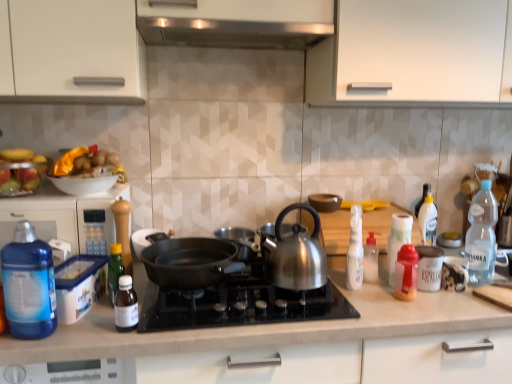
Question: Is blue plastic container at left behind translucent plastic bottle at lower left, marked as the sixth bottle in a right-to-left arrangement?

Choices:
 (A) yes
 (B) no

Answer: (A)

Question: From a real-world perspective, is blue plastic container at left physically above translucent plastic bottle at lower left, the third bottle viewed from the left?

Choices:
 (A) no
 (B) yes

Answer: (B)

Question: Is translucent plastic bottle at lower left, the third bottle viewed from the left, completely or partially inside blue plastic container at left?

Choices:
 (A) yes
 (B) no

Answer: (B)

Question: Can you confirm if blue plastic container at left is taller than translucent plastic bottle at lower left, marked as the sixth bottle in a right-to-left arrangement?

Choices:
 (A) no
 (B) yes

Answer: (B)

Question: From the image's perspective, is blue plastic container at left on translucent plastic bottle at lower left, marked as the sixth bottle in a right-to-left arrangement?

Choices:
 (A) yes
 (B) no

Answer: (A)

Question: Do you think satin silver exhaust hood at upper center is within translucent plastic bottle at right, positioned as the third bottle in right-to-left order, or outside of it?

Choices:
 (A) outside
 (B) inside

Answer: (A)

Question: From the image's perspective, is satin silver exhaust hood at upper center above or below translucent plastic bottle at right, the sixth bottle positioned from the left?

Choices:
 (A) above
 (B) below

Answer: (A)

Question: In the image, is satin silver exhaust hood at upper center positioned in front of or behind translucent plastic bottle at right, positioned as the third bottle in right-to-left order?

Choices:
 (A) front
 (B) behind

Answer: (B)

Question: From a real-world perspective, relative to translucent plastic bottle at right, the sixth bottle positioned from the left, is satin silver exhaust hood at upper center vertically above or below?

Choices:
 (A) below
 (B) above

Answer: (B)

Question: From a real-world perspective, is white plastic espresso cup at right, positioned as the 1th kitchen appliance in right-to-left order, physically located above or below blue translucent bottle at left, the 8th bottle when ordered from right to left?

Choices:
 (A) below
 (B) above

Answer: (A)

Question: From their relative heights in the image, would you say white plastic espresso cup at right, positioned as the 1th kitchen appliance in right-to-left order, is taller or shorter than blue translucent bottle at left, the 8th bottle when ordered from right to left?

Choices:
 (A) short
 (B) tall

Answer: (A)

Question: Based on their positions, is white plastic espresso cup at right, positioned as the 1th kitchen appliance in right-to-left order, located to the left or right of blue translucent bottle at left, the 8th bottle when ordered from right to left?

Choices:
 (A) right
 (B) left

Answer: (A)

Question: Considering their positions, is white plastic espresso cup at right, marked as the 4th kitchen appliance in a left-to-right arrangement, located in front of or behind blue translucent bottle at left, marked as the 1th bottle in a left-to-right arrangement?

Choices:
 (A) front
 (B) behind

Answer: (B)

Question: From their relative heights in the image, would you say transparent plastic bottle at right, which is counted as the 1th bottle, starting from the right, is taller or shorter than white plastic bottle at right, which is the 7th bottle in left-to-right order?

Choices:
 (A) short
 (B) tall

Answer: (B)

Question: Is transparent plastic bottle at right, which is counted as the 1th bottle, starting from the right, in front of or behind white plastic bottle at right, the second bottle from the right, in the image?

Choices:
 (A) front
 (B) behind

Answer: (B)